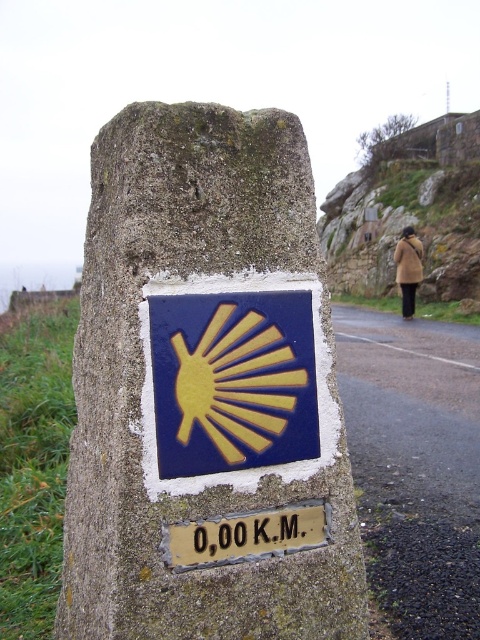
You are a hiker trying to determine the direction of the Camino de Santiago path. You notice two points marked on the stone marker. The first point is at coordinates point (328, 536) and the second point is at point (411, 227). Which point is closer to you as you face the marker?

Point (328, 536) is closer to the camera than point (411, 227), so the first point is closer to you as you face the marker.